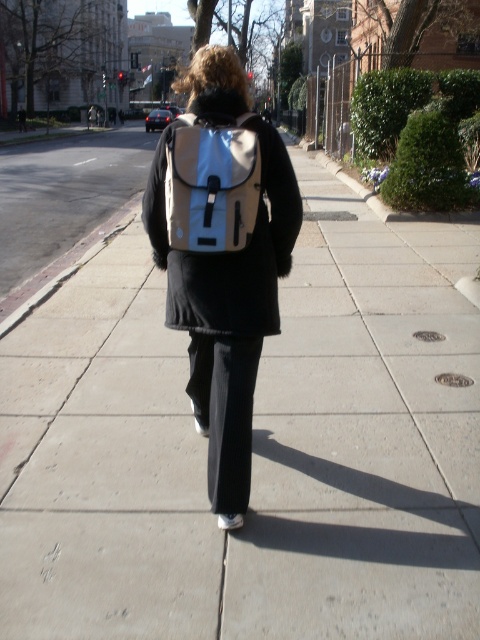
Question: Can you confirm if beige fabric backpack at center is positioned to the right of white matte backpack at center?

Choices:
 (A) no
 (B) yes

Answer: (A)

Question: Can you confirm if beige fabric backpack at center is positioned below white matte backpack at center?

Choices:
 (A) yes
 (B) no

Answer: (A)

Question: Which point is farther from the camera taking this photo?

Choices:
 (A) (219, 419)
 (B) (212, 129)

Answer: (A)

Question: From the image, what is the correct spatial relationship of beige fabric backpack at center in relation to white matte backpack at center?

Choices:
 (A) left
 (B) right

Answer: (A)